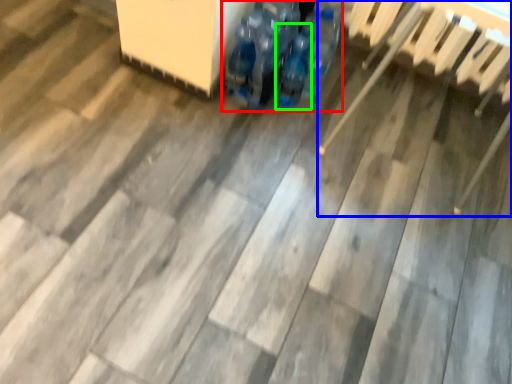
Question: Which object is positioned farthest from footwear (highlighted by a red box)? Select from chair (highlighted by a blue box) and bottle (highlighted by a green box).

Choices:
 (A) chair
 (B) bottle

Answer: (A)